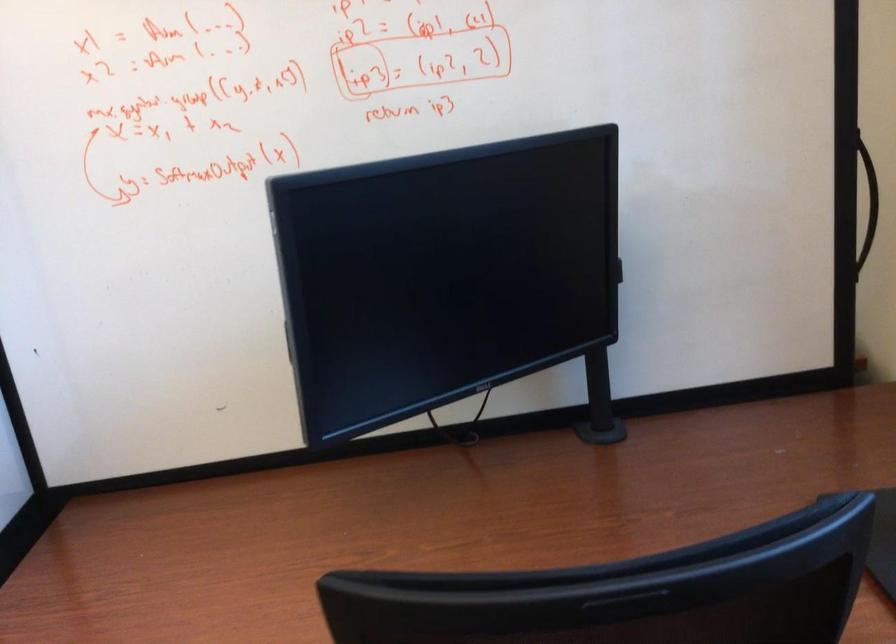
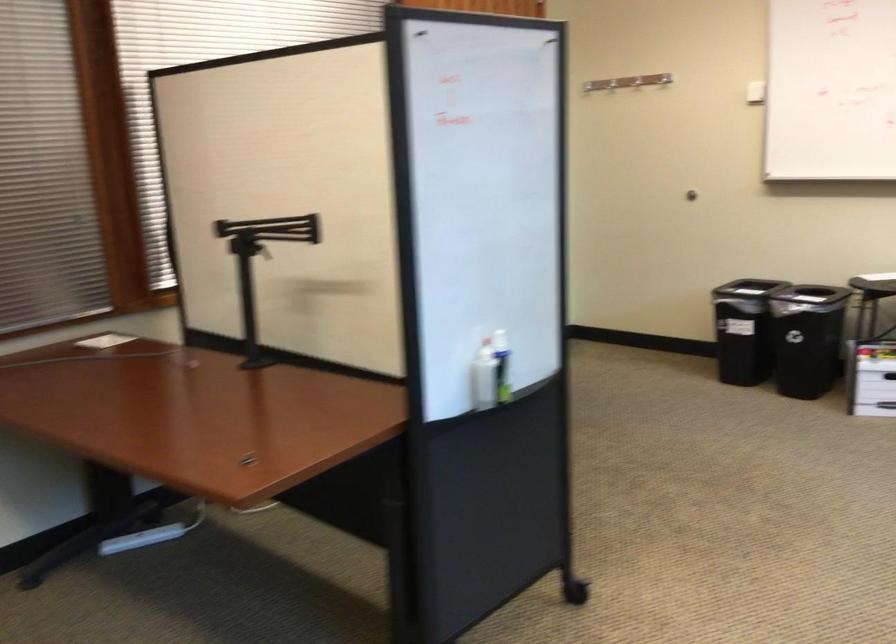
Question: The camera is either moving clockwise (left) or counter-clockwise (right) around the object. The first image is from the beginning of the video and the second image is from the end. Is the camera moving left or right when shooting the video?

Choices:
 (A) Left
 (B) Right

Answer: (B)